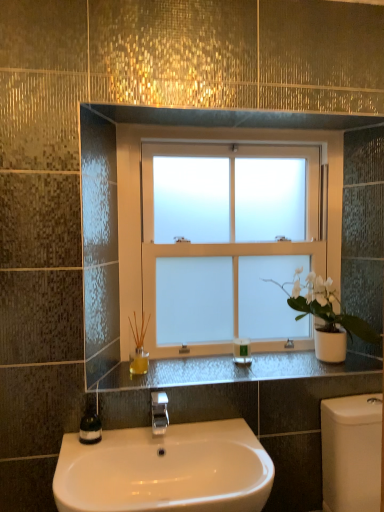
At what (x,y) coordinates should I click in order to perform the action: click on free space in front of green glass soap dispenser at lower left. Please return your answer as a coordinate pair (x, y). This screenshot has width=384, height=512. Looking at the image, I should click on [87, 451].